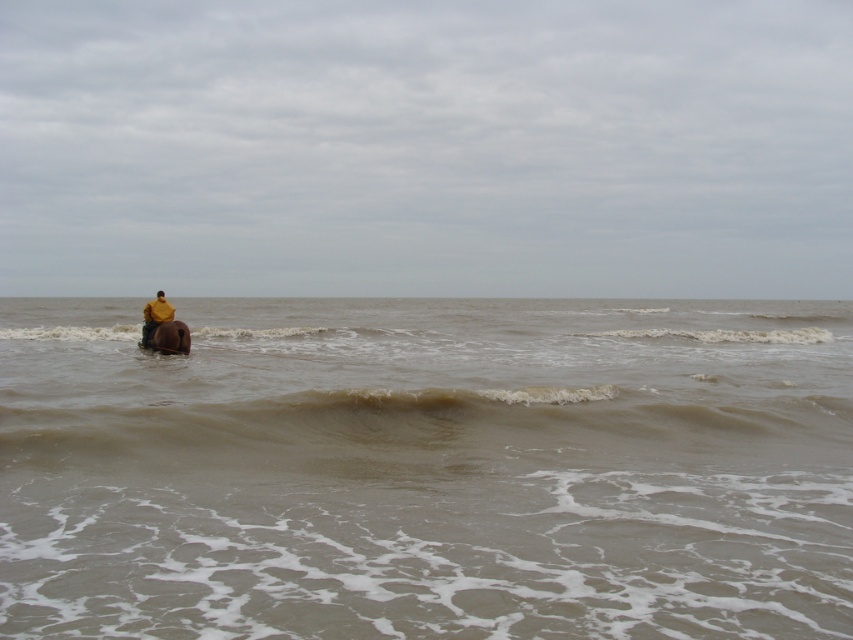
Question: Which object appears closest to the camera in this image?

Choices:
 (A) yellow matte jacket at center
 (B) brown matte horse at left

Answer: (B)

Question: Is brown muddy water at left wider than brown matte horse at left?

Choices:
 (A) no
 (B) yes

Answer: (B)

Question: Which object appears farthest from the camera in this image?

Choices:
 (A) brown muddy water at left
 (B) yellow matte jacket at center

Answer: (B)

Question: Does brown muddy water at left appear under brown matte horse at left?

Choices:
 (A) no
 (B) yes

Answer: (A)

Question: Which point is closer to the camera taking this photo?

Choices:
 (A) (172, 326)
 (B) (155, 305)

Answer: (A)

Question: Is brown matte horse at left below yellow matte jacket at center?

Choices:
 (A) no
 (B) yes

Answer: (B)